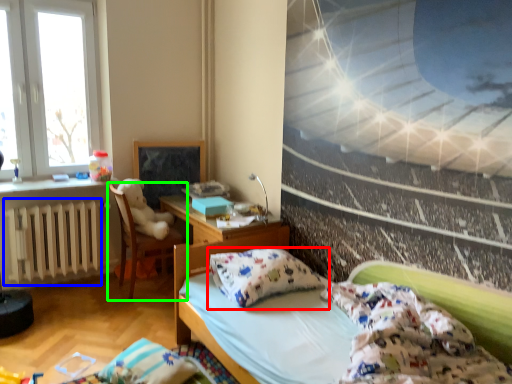
Question: Which object is the closest to the pillow (highlighted by a red box)? Choose among these: radiator (highlighted by a blue box) or chair (highlighted by a green box).

Choices:
 (A) radiator
 (B) chair

Answer: (B)